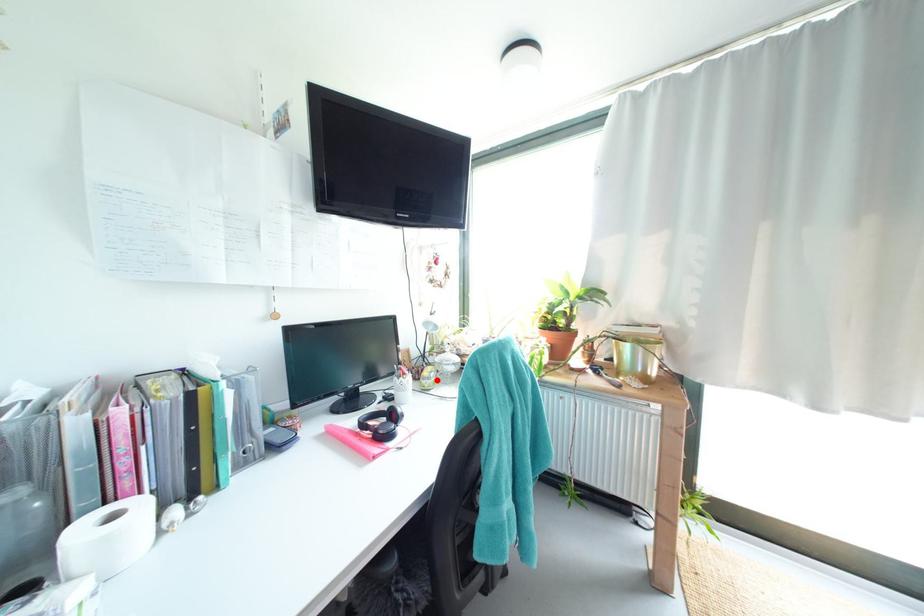
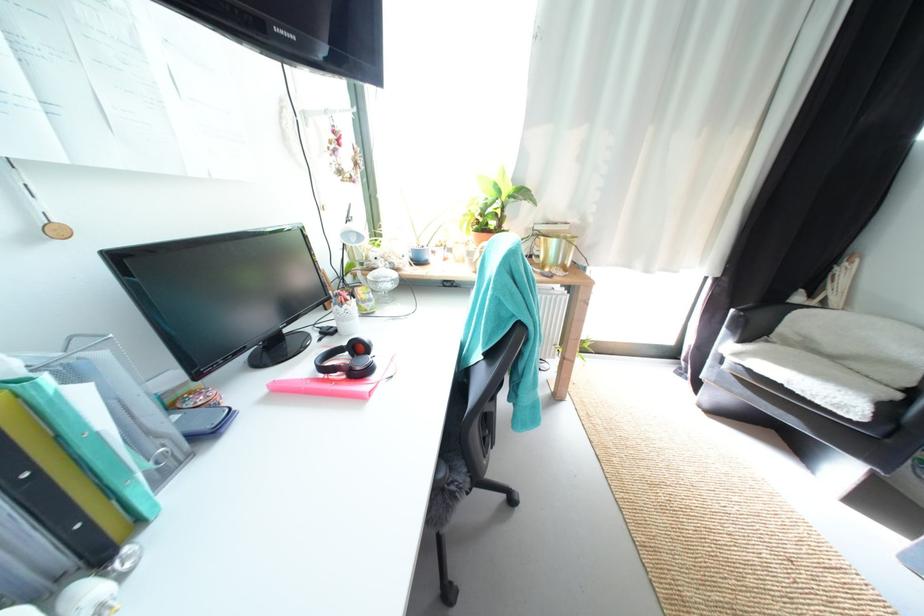
Question: I am providing you with two images of the same scene from different viewpoints. A red point is shown in image1. For the corresponding object point in image2, is it positioned nearer or farther from the camera?

Choices:
 (A) Nearer
 (B) Farther

Answer: (A)